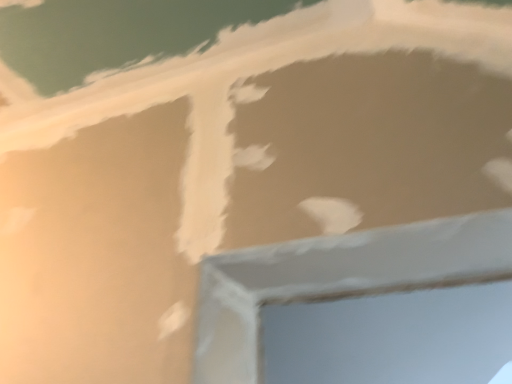
Where is `white matte window at center`? This screenshot has width=512, height=384. white matte window at center is located at coordinates (362, 307).

This screenshot has width=512, height=384. Describe the element at coordinates (362, 307) in the screenshot. I see `white matte window at center` at that location.

What is the approximate width of white matte window at center?

white matte window at center is 13.05 inches in width.

You are a GUI agent. You are given a task and a screenshot of the screen. Output one action in this format:
    pyautogui.click(x=<x>, y=<y>)
    Task: Click on the white matte window at center
    The height and width of the screenshot is (384, 512).
    Given the screenshot: What is the action you would take?
    pyautogui.click(x=362, y=307)